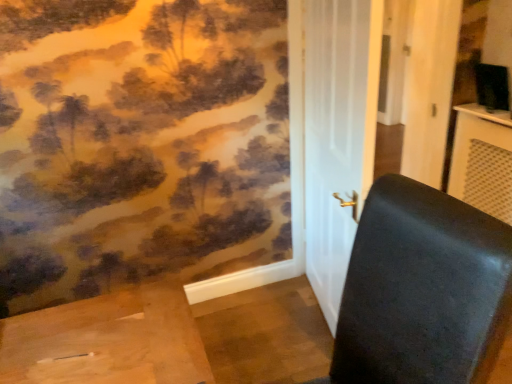
Question: Can matte black table at right be found inside black leather chair at right?

Choices:
 (A) yes
 (B) no

Answer: (B)

Question: Is black leather chair at right positioned far away from matte black table at right?

Choices:
 (A) no
 (B) yes

Answer: (B)

Question: From a real-world perspective, is black leather chair at right positioned under matte black table at right based on gravity?

Choices:
 (A) yes
 (B) no

Answer: (B)

Question: Can you confirm if black leather chair at right is positioned to the left of matte black table at right?

Choices:
 (A) yes
 (B) no

Answer: (A)

Question: From the image's perspective, is black leather chair at right above matte black table at right?

Choices:
 (A) yes
 (B) no

Answer: (B)

Question: Does black leather chair at right have a lesser width compared to matte black table at right?

Choices:
 (A) no
 (B) yes

Answer: (A)

Question: From a real-world perspective, is matte black table at right under white glossy door at center?

Choices:
 (A) no
 (B) yes

Answer: (B)

Question: From the image's perspective, is matte black table at right under white glossy door at center?

Choices:
 (A) no
 (B) yes

Answer: (B)

Question: Is matte black table at right in front of white glossy door at center?

Choices:
 (A) no
 (B) yes

Answer: (A)

Question: Does matte black table at right have a greater height compared to white glossy door at center?

Choices:
 (A) no
 (B) yes

Answer: (A)

Question: Considering the relative sizes of matte black table at right and white glossy door at center in the image provided, is matte black table at right smaller than white glossy door at center?

Choices:
 (A) no
 (B) yes

Answer: (B)

Question: Can you confirm if matte black table at right is wider than white glossy door at center?

Choices:
 (A) yes
 (B) no

Answer: (A)

Question: Can you confirm if matte black table at right is bigger than black leather chair at right?

Choices:
 (A) yes
 (B) no

Answer: (B)